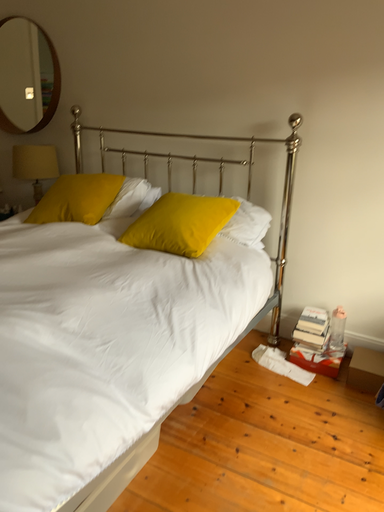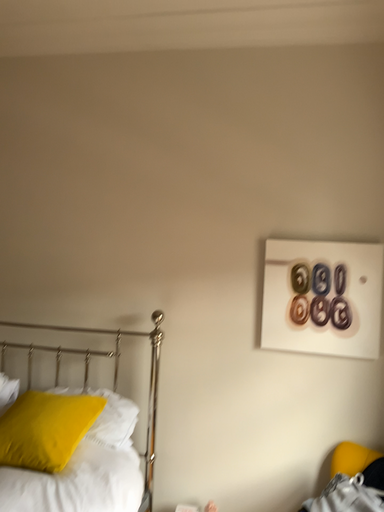
Question: Which way did the camera rotate in the video?

Choices:
 (A) rotated downward
 (B) rotated upward

Answer: (B)